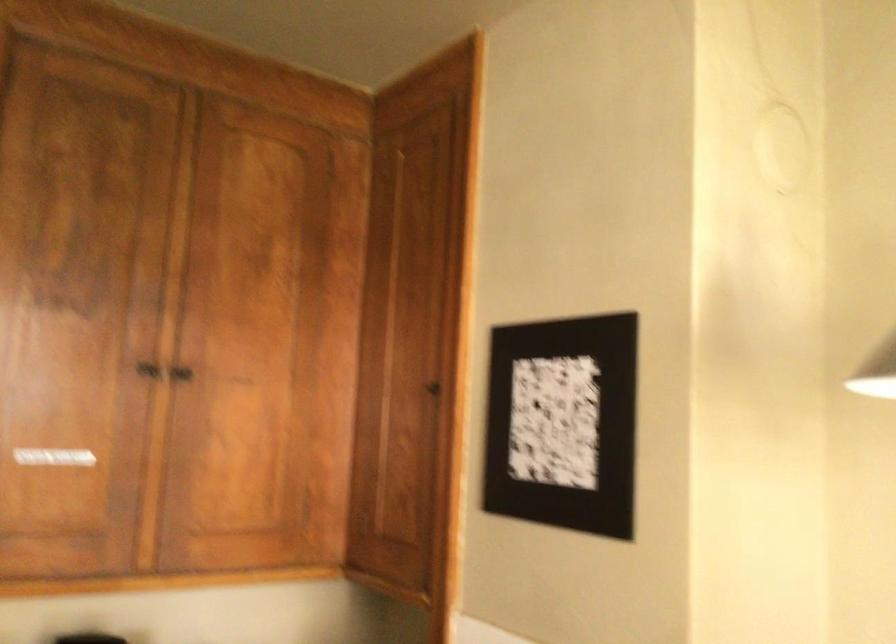
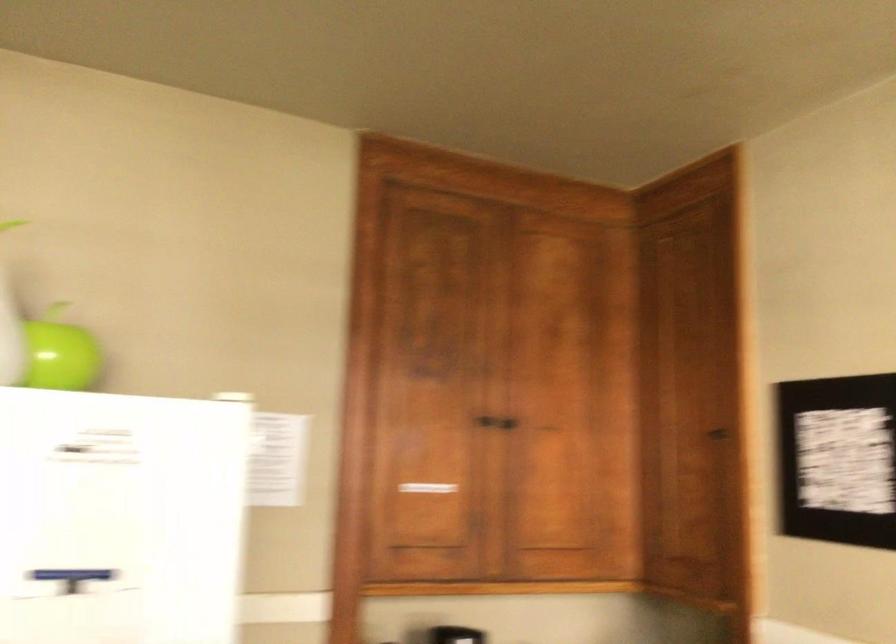
Which direction would the cameraman need to move to produce the second image?

The cameraman moved toward left, backward.